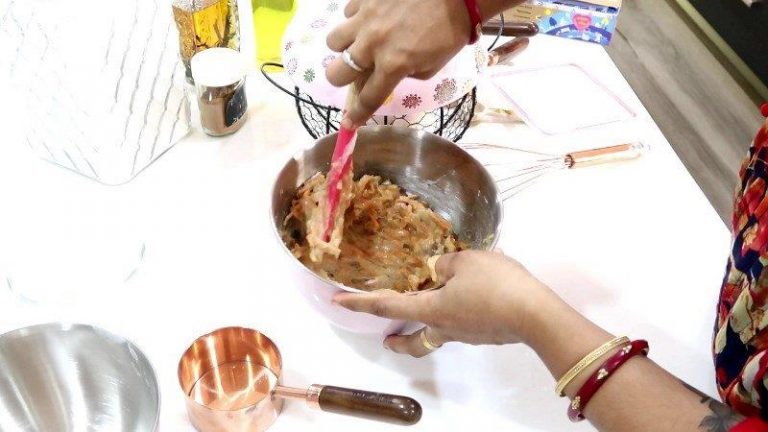
The image size is (768, 432). I want to click on gray wooden flooring, so click(x=682, y=57).